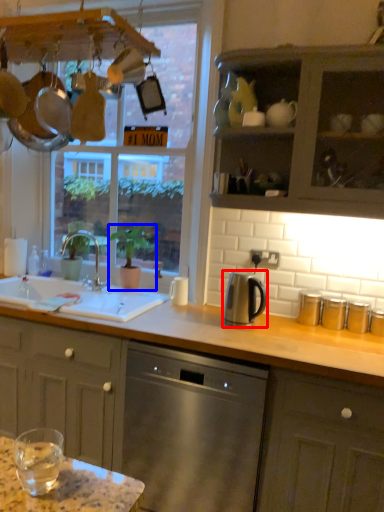
Question: Which point is closer to the camera, kitchen appliance (highlighted by a red box) or houseplant (highlighted by a blue box)?

Choices:
 (A) kitchen appliance
 (B) houseplant

Answer: (A)